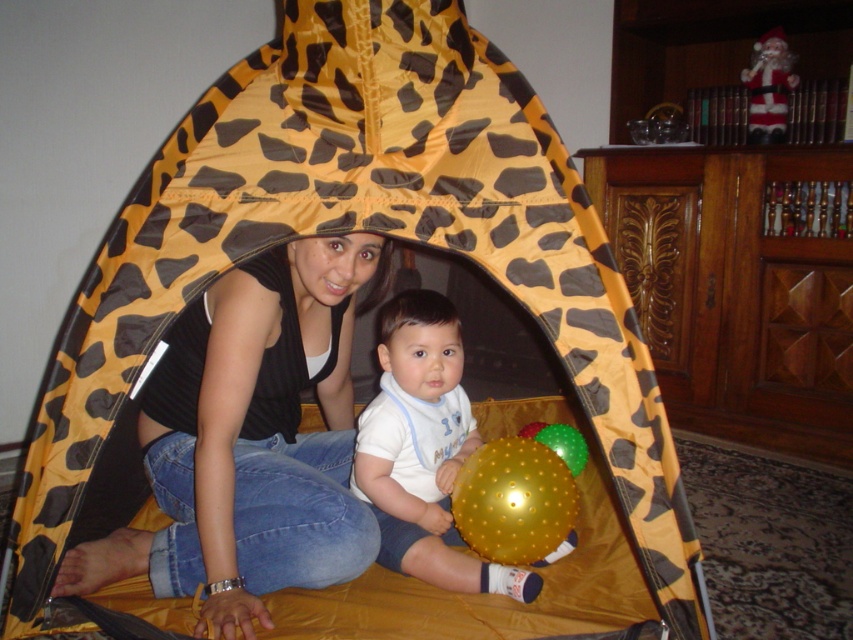
Can you confirm if white soft fabric at center is shorter than santa claus figure at upper right?

In fact, white soft fabric at center may be taller than santa claus figure at upper right.

Does white soft fabric at center appear under santa claus figure at upper right?

Yes.

Who is more distant from viewer, (425, 573) or (753, 129)?

Positioned behind is point (753, 129).

Locate an element on the screen. The width and height of the screenshot is (853, 640). white soft fabric at center is located at coordinates (422, 449).

Which is behind, point (311, 513) or point (759, 120)?

The point (759, 120) is more distant.

You are a GUI agent. You are given a task and a screenshot of the screen. Output one action in this format:
    pyautogui.click(x=<x>, y=<y>)
    Task: Click on the matte black tank top at center
    This screenshot has height=640, width=853.
    Given the screenshot: What is the action you would take?
    pyautogui.click(x=250, y=440)

Who is lower down, matte black tank top at center or white soft fabric at center?

Positioned lower is white soft fabric at center.

Is point (350, 529) closer to viewer compared to point (430, 440)?

Yes, it is.

Is point (286, 472) closer to camera compared to point (426, 522)?

Yes, it is.

This screenshot has height=640, width=853. What are the coordinates of `matte black tank top at center` in the screenshot? It's located at (250, 440).